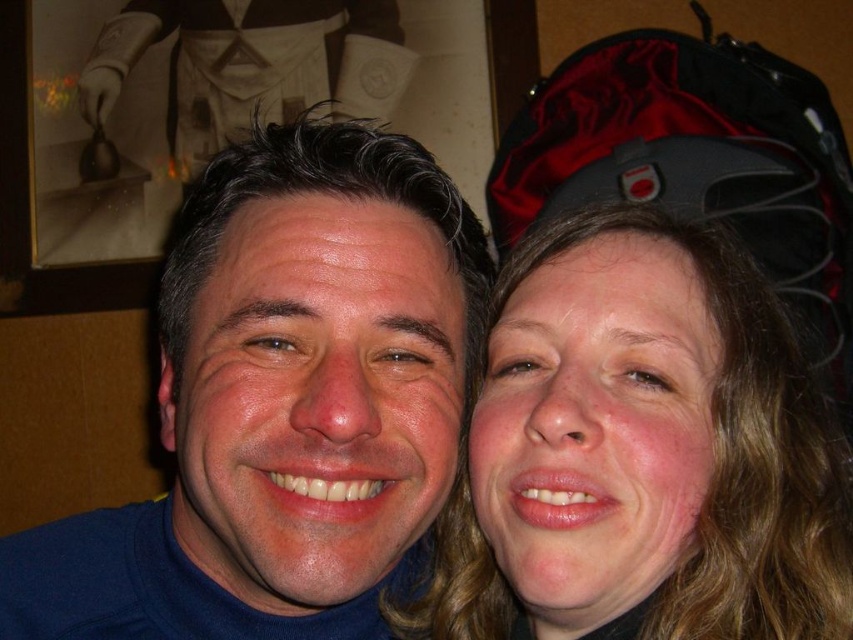
Question: Can you confirm if smooth skin face at right is smaller than white cloth at upper center?

Choices:
 (A) no
 (B) yes

Answer: (B)

Question: Which object appears farthest from the camera in this image?

Choices:
 (A) blue turtleneck sweater at center
 (B) white cloth at upper center

Answer: (B)

Question: Which of these objects is positioned farthest from the smooth skin face at right?

Choices:
 (A) white cloth at upper center
 (B) blue turtleneck sweater at center

Answer: (A)

Question: Can you confirm if smooth skin face at right is positioned to the left of white cloth at upper center?

Choices:
 (A) no
 (B) yes

Answer: (A)

Question: Is smooth skin face at right bigger than white cloth at upper center?

Choices:
 (A) yes
 (B) no

Answer: (B)

Question: Which object appears closest to the camera in this image?

Choices:
 (A) white cloth at upper center
 (B) blue turtleneck sweater at center
 (C) smooth skin face at right

Answer: (B)